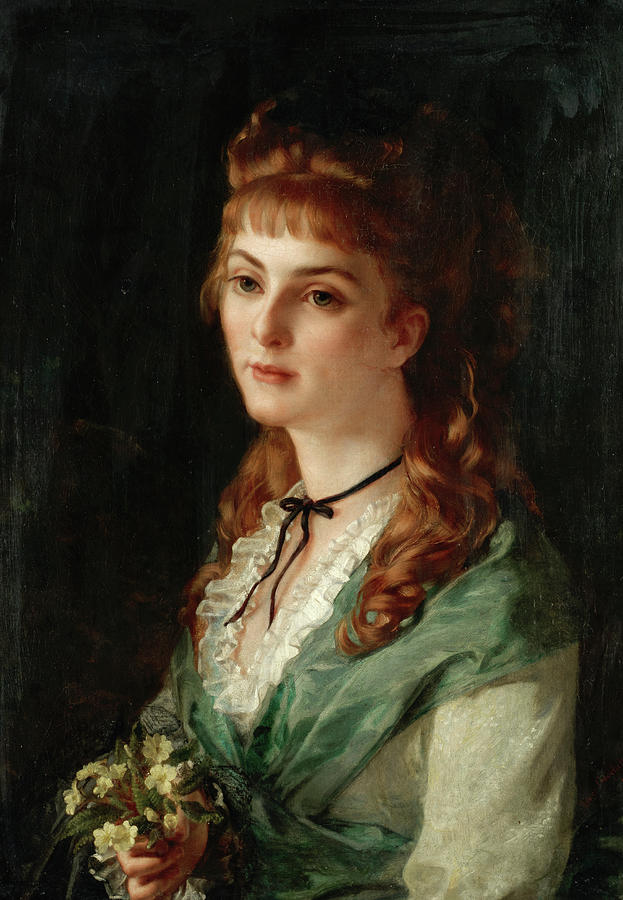
I want to click on portrait, so click(358, 718).